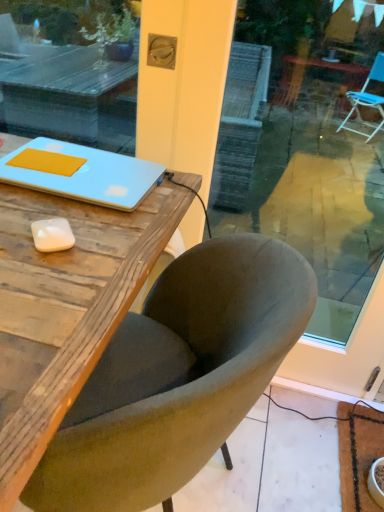
Find the location of `vacant region above matte blue laptop at upper left (from a real-world perspective)`. vacant region above matte blue laptop at upper left (from a real-world perspective) is located at coordinates (76, 164).